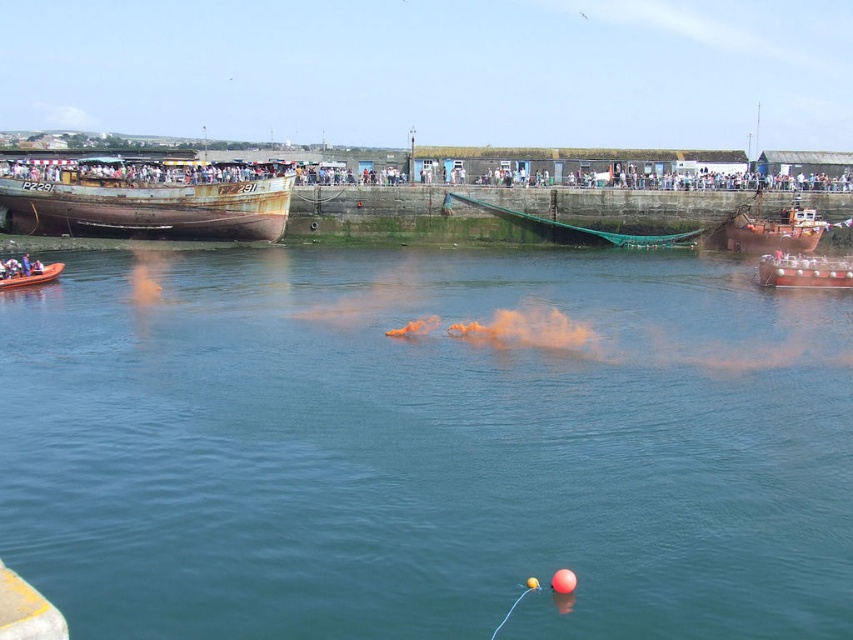
You are a photographer trying to capture the metallic silver boat at right and the orange rubber balloon at center in the same frame. Given their sizes, which object should you focus on first to ensure both are clearly visible in your photo?

The metallic silver boat at right is larger than the orange rubber balloon at center, so you should focus on the metallic silver boat at right first to ensure both are clearly visible in your photo.

You are a safety officer at the harbor and need to ensure that the orange smoke at center and orange rubber balloon at center do not interfere with each other. Based on their positions, which one is higher and needs to be monitored for potential collision with the other?

The orange smoke at center is above the orange rubber balloon at center, so it is higher and needs to be monitored for potential collision with the orange rubber balloon at center.